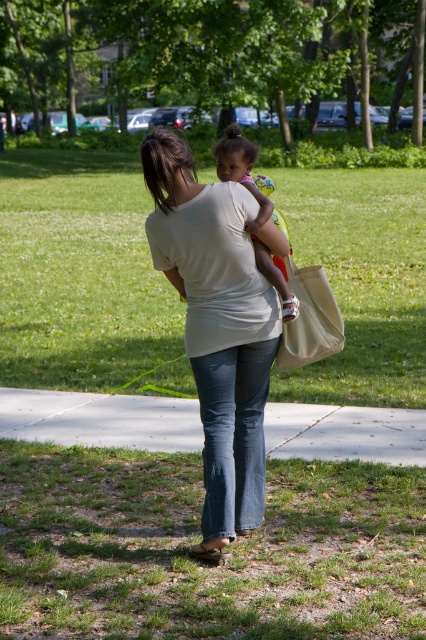
Question: Is green grass at center below matte pink dress at center?

Choices:
 (A) no
 (B) yes

Answer: (A)

Question: Does green grass at lower center appear on the right side of denim jeans at center?

Choices:
 (A) no
 (B) yes

Answer: (A)

Question: Which of the following is the farthest from the observer?

Choices:
 (A) matte pink dress at center
 (B) white matte shirt at center
 (C) denim jeans at center

Answer: (A)

Question: Based on their relative distances, which object is farther from the green grass at center?

Choices:
 (A) denim jeans at center
 (B) green grass at lower center
 (C) white matte shirt at center

Answer: (C)

Question: Considering the relative positions of white matte shirt at center and matte pink dress at center in the image provided, where is white matte shirt at center located with respect to matte pink dress at center?

Choices:
 (A) below
 (B) above

Answer: (A)

Question: Which point appears closest to the camera in this image?

Choices:
 (A) (178, 193)
 (B) (252, 237)
 (C) (94, 276)

Answer: (A)